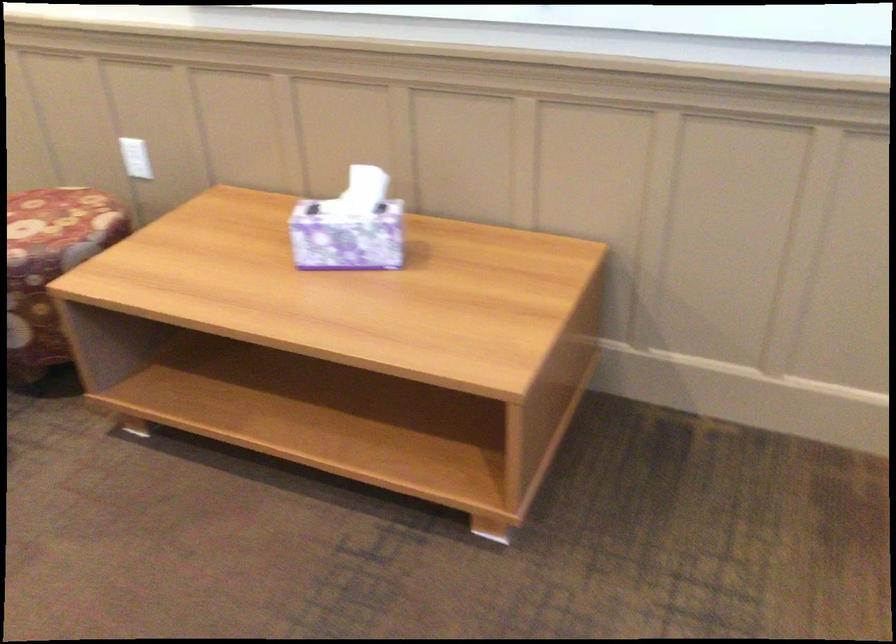
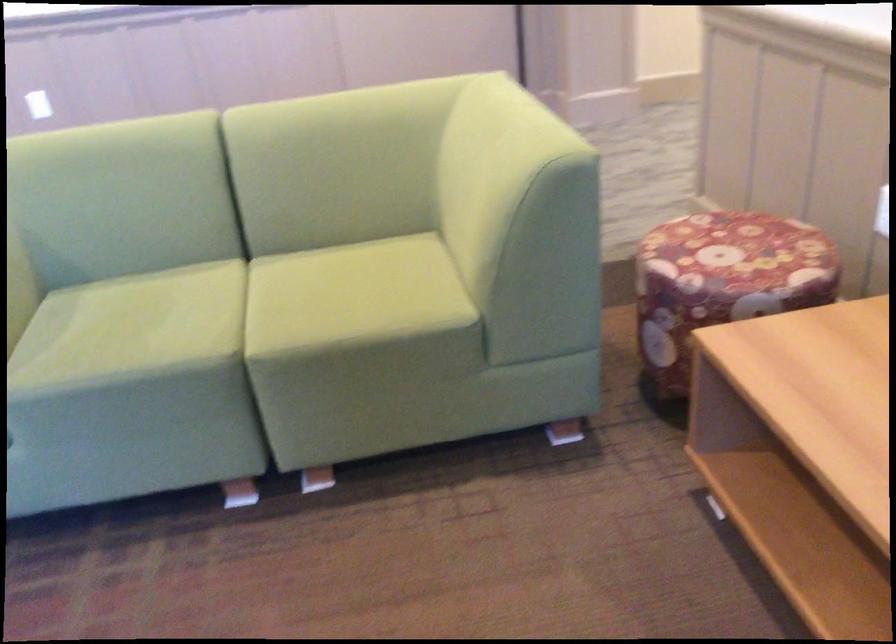
Question: How did the camera likely rotate?

Choices:
 (A) Left
 (B) Right
 (C) Up
 (D) Down

Answer: (A)